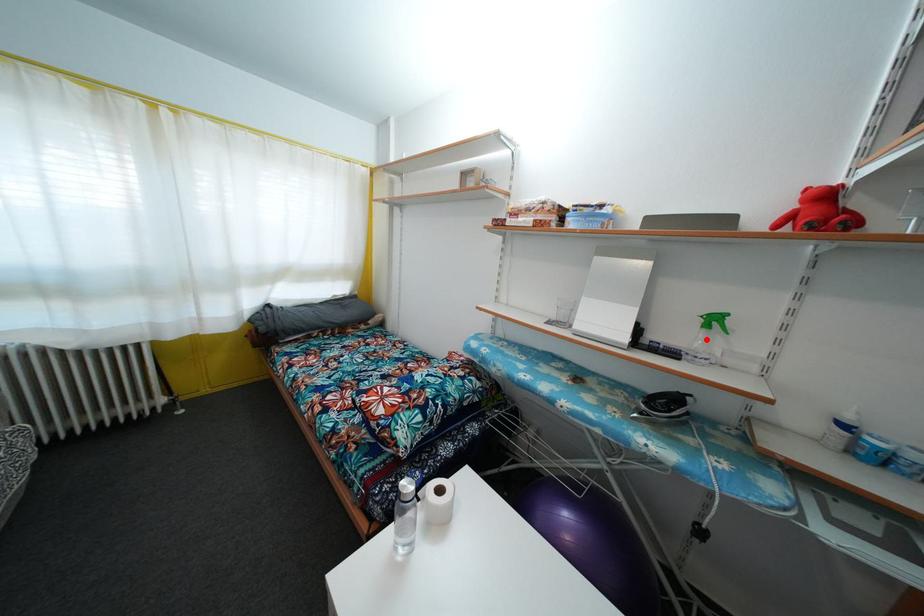
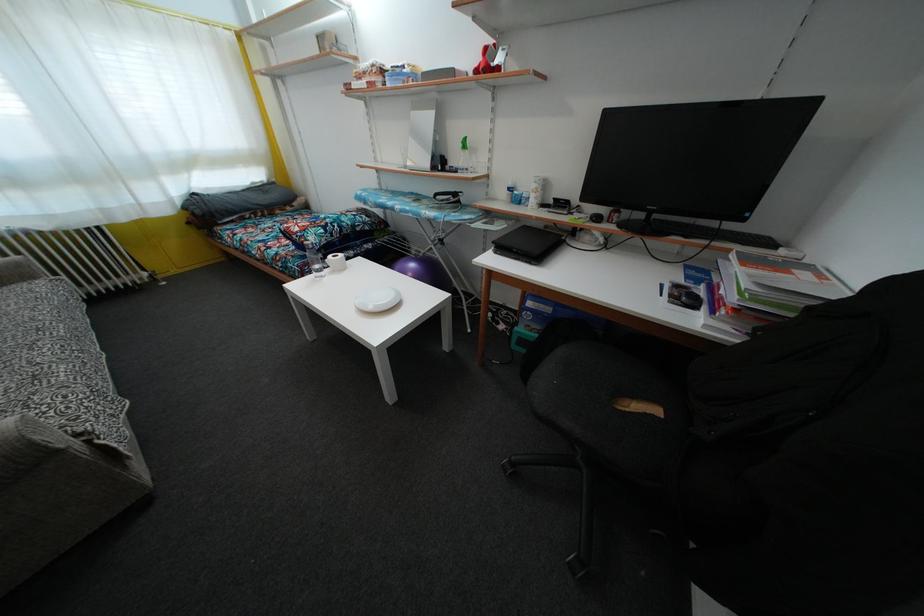
Question: I am providing you with two images of the same scene from different viewpoints. Given a red point in image1, look at the same physical point in image2. Is it:

Choices:
 (A) Closer to the viewpoint
 (B) Farther from the viewpoint

Answer: (A)